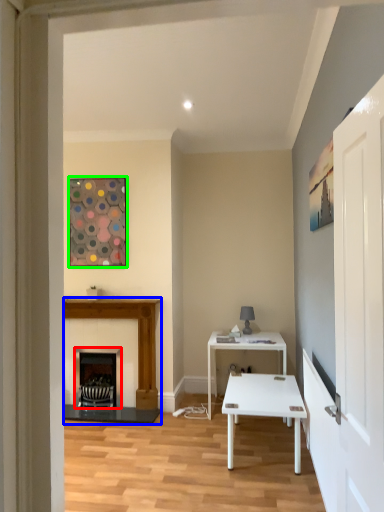
Question: Estimate the real-world distances between objects in this image. Which object is closer to fireplace (highlighted by a red box), fireplace (highlighted by a blue box) or picture frame (highlighted by a green box)?

Choices:
 (A) fireplace
 (B) picture frame

Answer: (A)